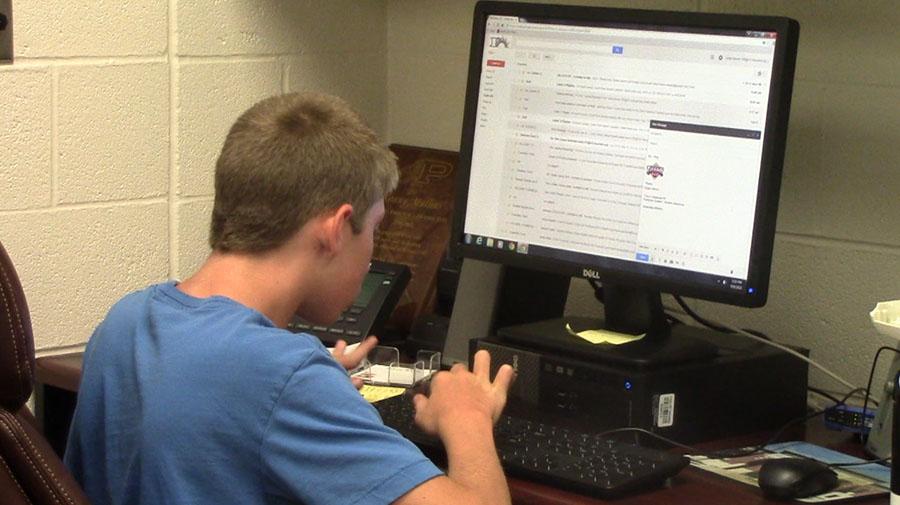
Where is `chair`? chair is located at coordinates (11, 355).